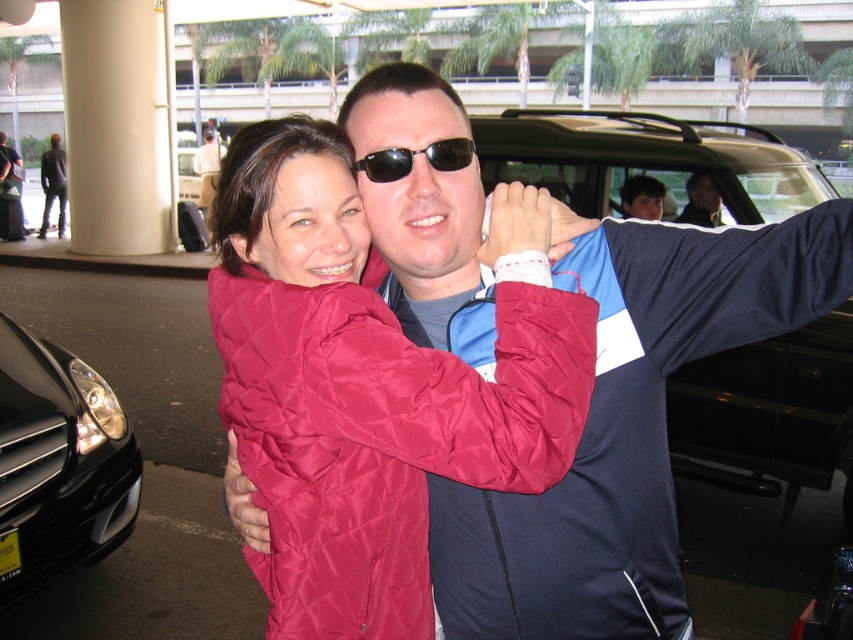
Question: Is quilted red jacket at center above black plastic sunglasses at center?

Choices:
 (A) no
 (B) yes

Answer: (A)

Question: Is quilted red jacket at center bigger than black glossy car at lower left?

Choices:
 (A) yes
 (B) no

Answer: (B)

Question: Observing the image, what is the correct spatial positioning of quilted red jacket at center in reference to black glossy car at lower left?

Choices:
 (A) above
 (B) below

Answer: (A)

Question: Which object is farther from the camera taking this photo?

Choices:
 (A) quilted red jacket at center
 (B) black plastic sunglasses at center
 (C) black glossy car at lower left

Answer: (C)

Question: Which point is closer to the camera?

Choices:
 (A) (448, 144)
 (B) (19, 419)
 (C) (357, 348)
 (D) (503, 124)

Answer: (C)

Question: Which point is farther to the camera?

Choices:
 (A) black matte car at right
 (B) black glossy car at lower left
 (C) quilted red jacket at center
 (D) black plastic sunglasses at center

Answer: (A)